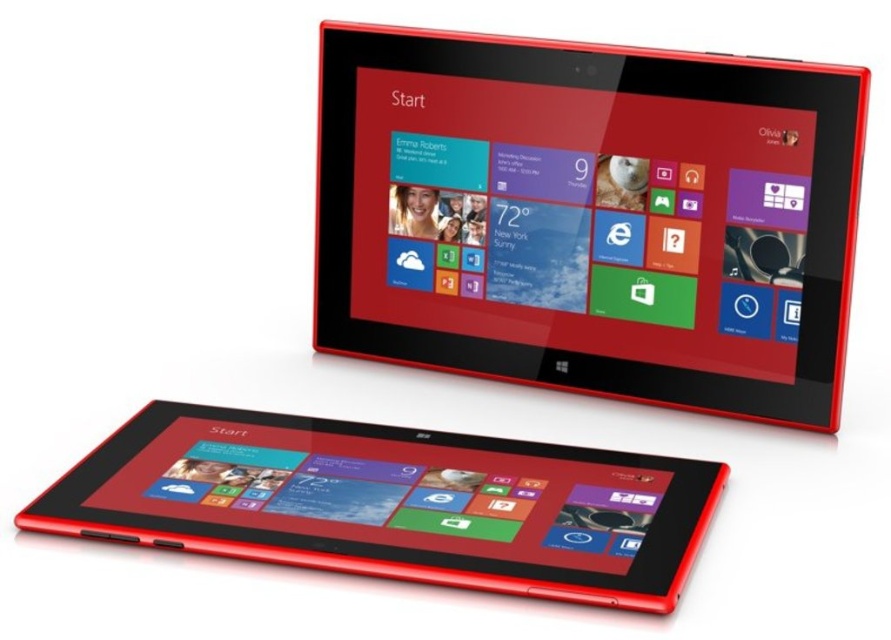
Question: In this image, where is matte plastic tablet at upper center located relative to matte black tablet at lower left?

Choices:
 (A) right
 (B) left

Answer: (A)

Question: Which object appears closest to the camera in this image?

Choices:
 (A) matte black tablet at lower left
 (B) matte plastic tablet at upper center

Answer: (A)

Question: Which object appears closest to the camera in this image?

Choices:
 (A) matte plastic tablet at upper center
 (B) matte black tablet at lower left

Answer: (B)

Question: Does matte plastic tablet at upper center appear on the left side of matte black tablet at lower left?

Choices:
 (A) yes
 (B) no

Answer: (B)

Question: Is matte plastic tablet at upper center bigger than matte black tablet at lower left?

Choices:
 (A) no
 (B) yes

Answer: (B)

Question: Among these points, which one is farthest from the camera?

Choices:
 (A) (586, 282)
 (B) (427, 464)

Answer: (A)